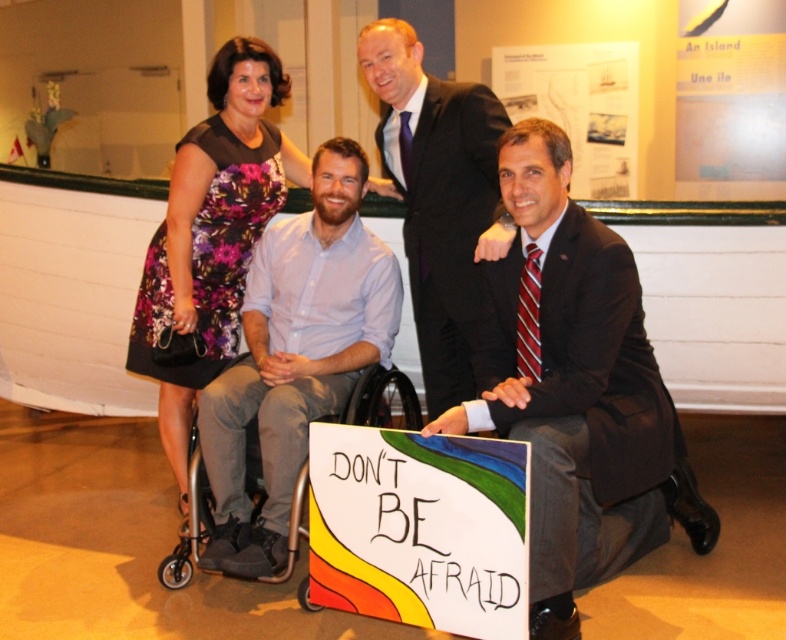
Who is positioned more to the left, matte black suit at upper center or silver metallic wheelchair at center?

silver metallic wheelchair at center

In the scene shown: Who is higher up, matte black suit at upper center or silver metallic wheelchair at center?

Positioned higher is matte black suit at upper center.

Between point (502, 256) and point (189, 465), which one is positioned behind?

The point (189, 465) is behind.

The image size is (786, 640). Identify the location of matte black suit at upper center. (439, 196).

Can you confirm if floral dress at upper left is positioned above silver metallic wheelchair at center?

Correct, floral dress at upper left is located above silver metallic wheelchair at center.

Between point (182, 317) and point (193, 548), which one is positioned in front?

Point (193, 548)

This screenshot has width=786, height=640. Find the location of `floral dress at upper left`. floral dress at upper left is located at coordinates (212, 232).

From the picture: Can you confirm if hand-painted paper sign at lower center is positioned below matte black suit at upper center?

Correct, hand-painted paper sign at lower center is located below matte black suit at upper center.

Consider the image. Who is more distant from viewer, (x=483, y=580) or (x=430, y=289)?

The point (x=430, y=289) is more distant.

I want to click on hand-painted paper sign at lower center, so click(419, 529).